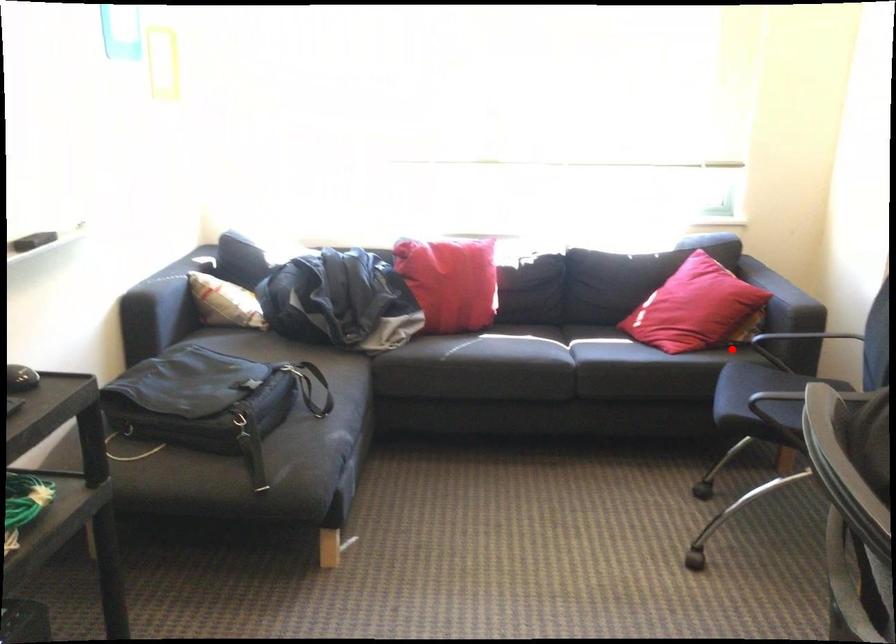
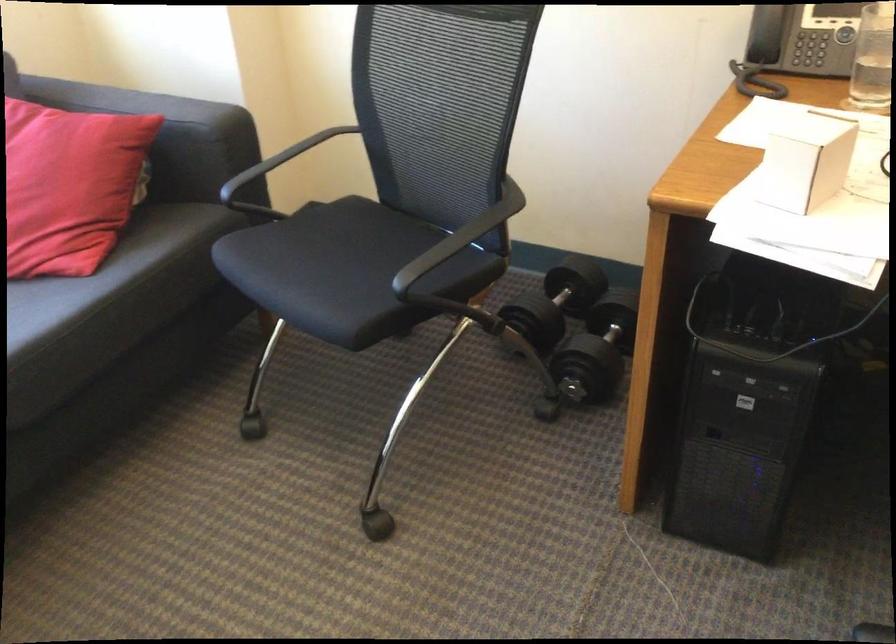
Find the pixel in the second image that matches the highlighted location in the first image.

(156, 230)